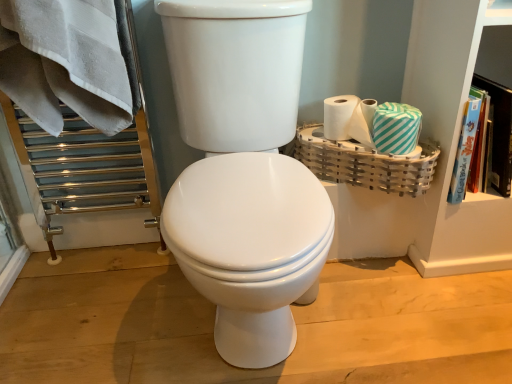
Question: Looking at the image, does white glossy toilet at center seem bigger or smaller compared to teal striped tissue at right?

Choices:
 (A) big
 (B) small

Answer: (A)

Question: Considering the relative positions of white glossy toilet at center and teal striped tissue at right in the image provided, is white glossy toilet at center to the left or to the right of teal striped tissue at right?

Choices:
 (A) right
 (B) left

Answer: (B)

Question: Estimate the real-world distances between objects in this image. Which object is closer to the hardcover book at upper right?

Choices:
 (A) green striped toilet paper at right
 (B) teal striped tissue at right
 (C) bamboo basket at right
 (D) white glossy toilet at center

Answer: (B)

Question: Which is farther from the green striped toilet paper at right?

Choices:
 (A) bamboo basket at right
 (B) hardcover book at upper right
 (C) teal striped tissue at right
 (D) white glossy toilet at center

Answer: (D)